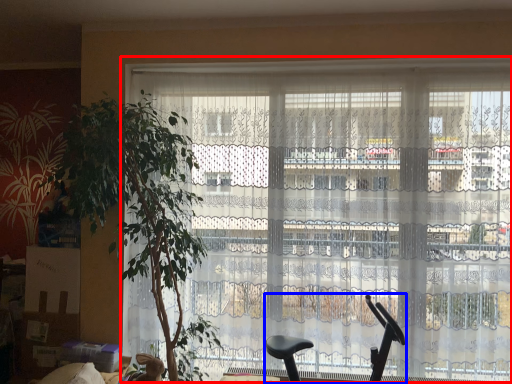
Question: Which point is further to the camera, window (highlighted by a red box) or baby carriage (highlighted by a blue box)?

Choices:
 (A) window
 (B) baby carriage

Answer: (A)